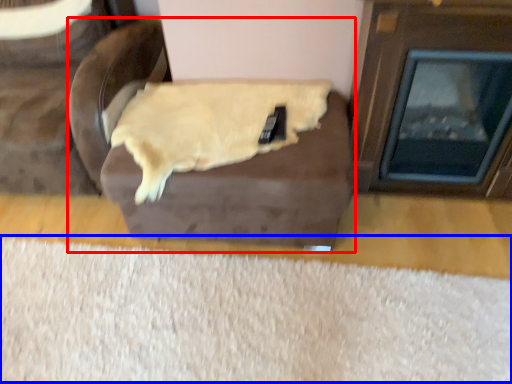
Question: Among these objects, which one is farthest to the camera, furniture (highlighted by a red box) or mat (highlighted by a blue box)?

Choices:
 (A) furniture
 (B) mat

Answer: (A)